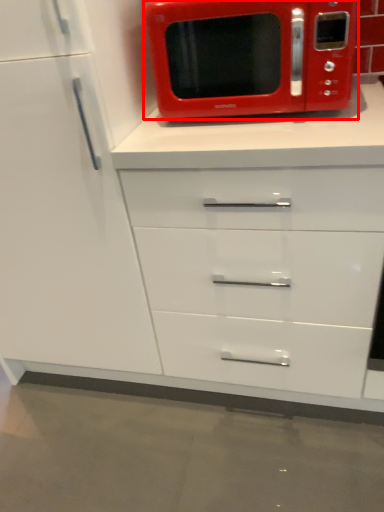
Question: From the image's perspective, where is microwave oven (annotated by the red box) located in relation to cabinetry in the image?

Choices:
 (A) above
 (B) below

Answer: (A)